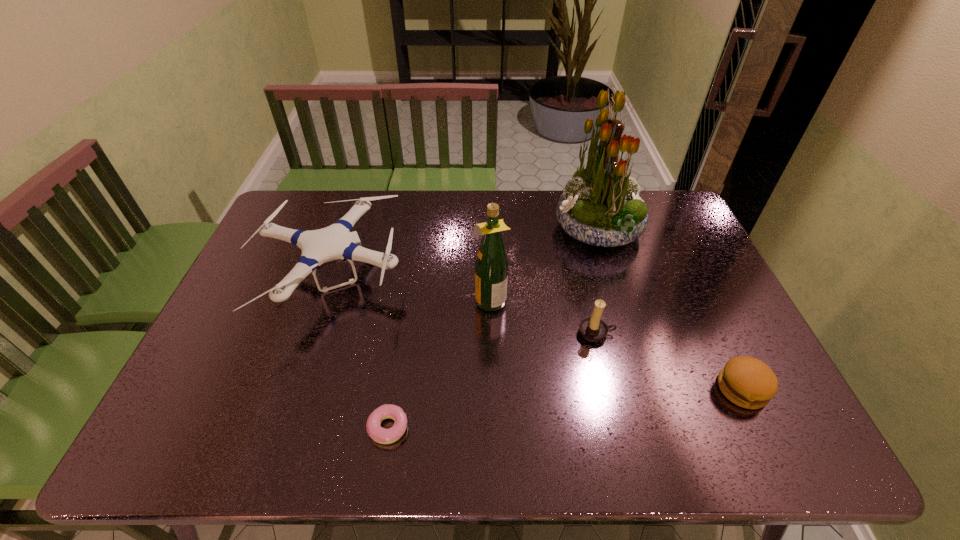
At what (x,y) coordinates should I click in order to perform the action: click on vacant space located on the front-facing side of the flower arrangement. Please return your answer as a coordinate pair (x, y). The height and width of the screenshot is (540, 960). Looking at the image, I should click on (482, 229).

At what (x,y) coordinates should I click in order to perform the action: click on free space located on the front-facing side of the third object from left to right. Please return your answer as a coordinate pair (x, y). The height and width of the screenshot is (540, 960). Looking at the image, I should click on [348, 299].

Identify the location of vacant space situated 0.210m on the front-facing side of the third object from left to right. (400, 299).

Find the location of a particular element. free location located 0.320m on the front-facing side of the third object from left to right is located at coordinates (362, 299).

Find the location of a particular element. This screenshot has width=960, height=540. vacant area located on the back of the drone is located at coordinates 360,195.

Where is `free space located on the wick of the candle holder`? free space located on the wick of the candle holder is located at coordinates (617, 423).

Where is `vacant region located on the back of the rightmost object`? Image resolution: width=960 pixels, height=540 pixels. vacant region located on the back of the rightmost object is located at coordinates (724, 352).

You are a GUI agent. You are given a task and a screenshot of the screen. Output one action in this format:
    pyautogui.click(x=<x>, y=<y>)
    Task: Click on the free location located 0.160m on the back of the doughnut
    
    Given the screenshot: What is the action you would take?
    pyautogui.click(x=400, y=353)

This screenshot has height=540, width=960. In order to click on flower arrangement that is at the far edge in this screenshot , I will do `click(600, 206)`.

The image size is (960, 540). I want to click on drone situated at the far edge, so click(334, 242).